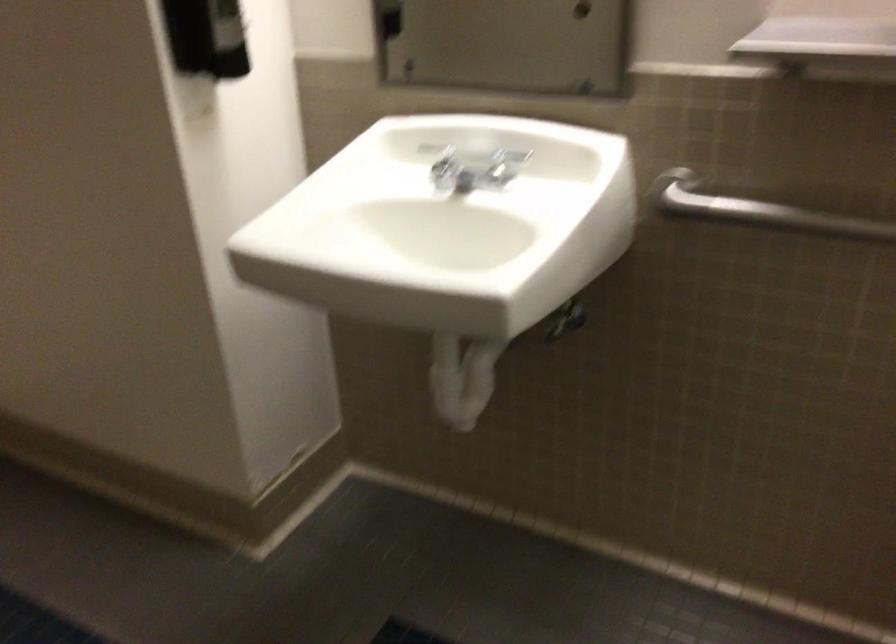
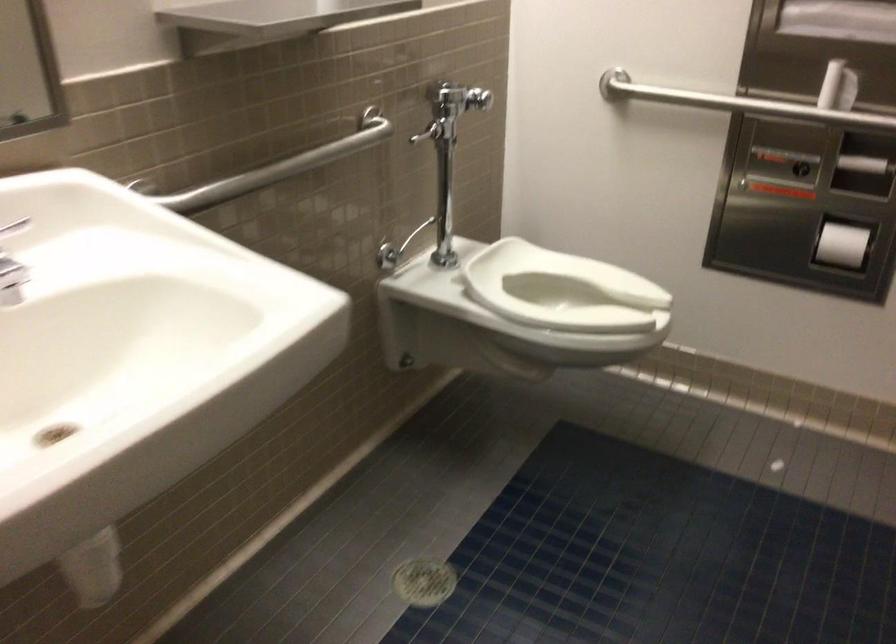
The point at (822,216) is marked in the first image. Where is the corresponding point in the second image?

(277, 167)